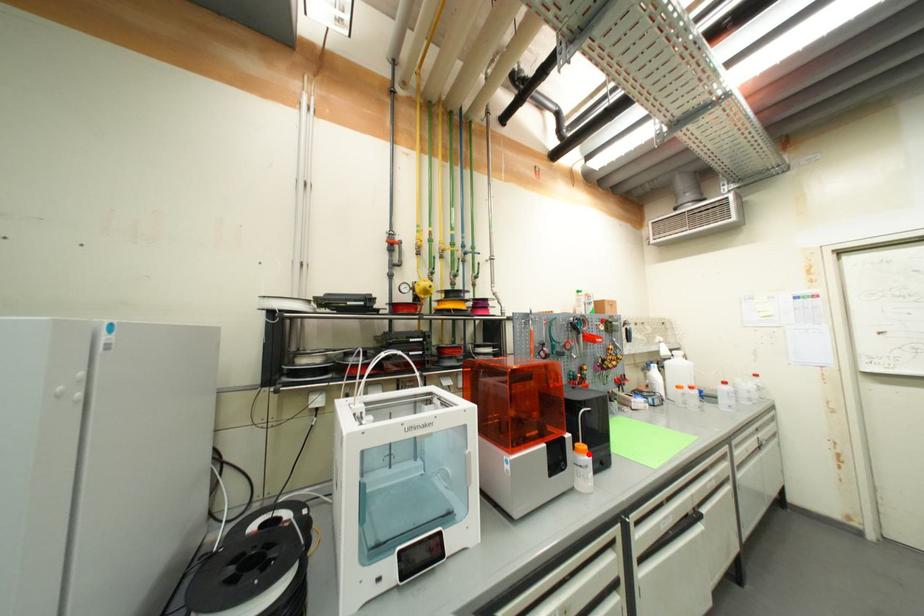
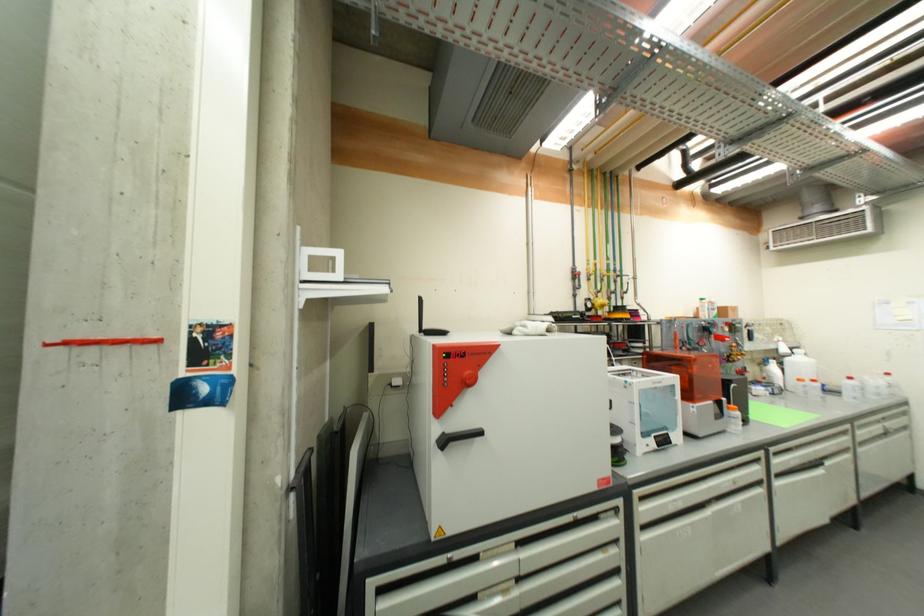
Question: I am providing you with two images of the same scene from different viewpoints. A red point is marked on the first image. At the location where the point appears in image 1, is it still visible in image 2?

Choices:
 (A) Yes
 (B) No

Answer: (A)